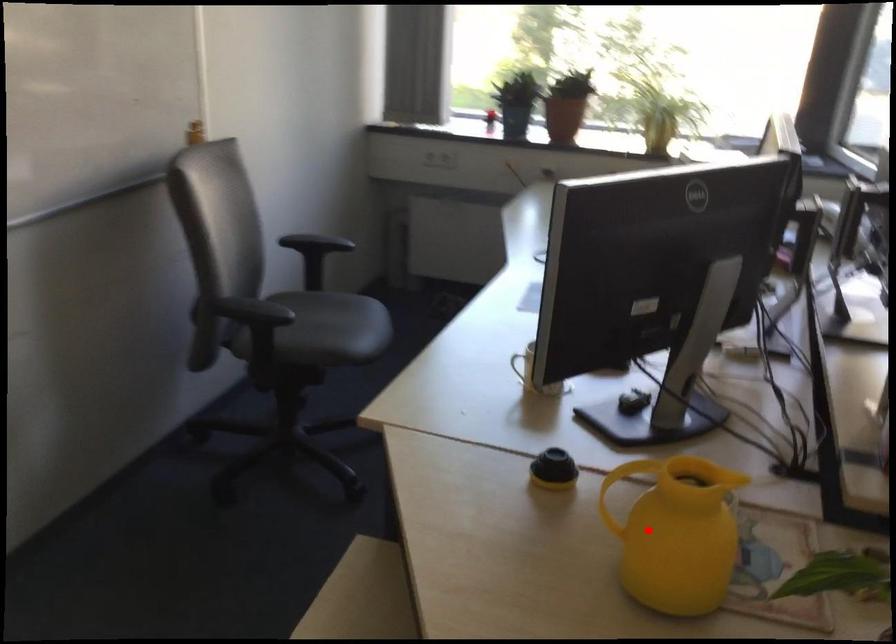
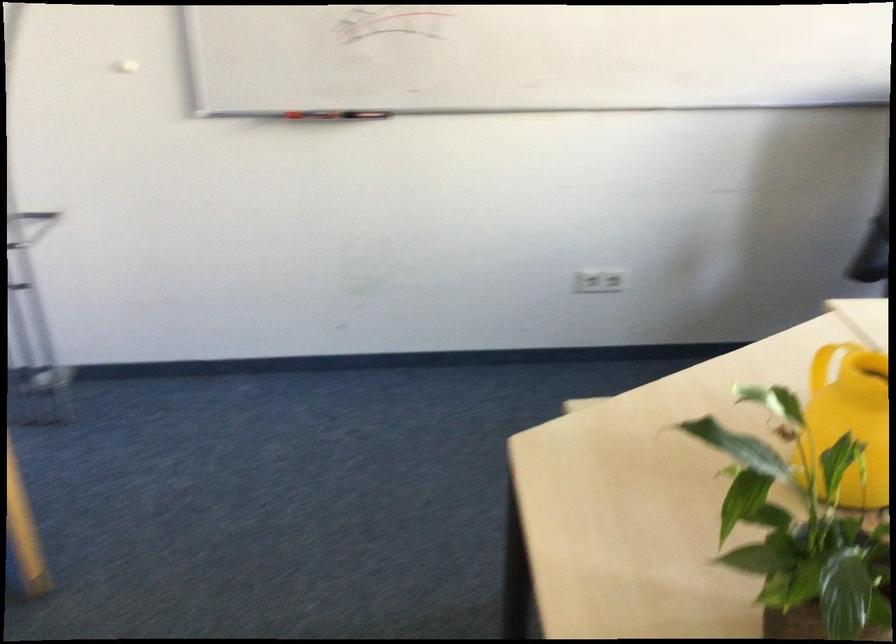
Find the pixel in the second image that matches the highlighted location in the first image.

(849, 420)